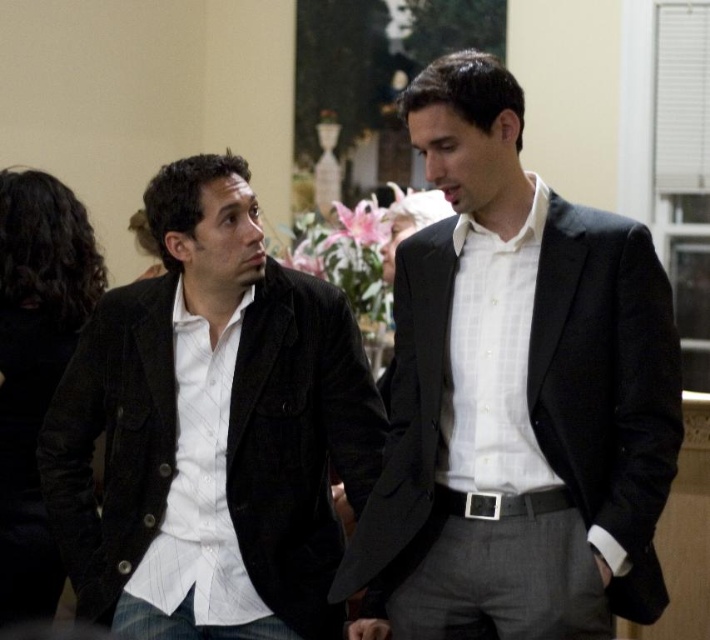
You are standing in the room and want to approach the person wearing the matte black jacket at left. Which direction should you move relative to the matte black suit at center?

To reach the matte black jacket at left, you should move to the left of the matte black suit at center since the matte black jacket at left is positioned to the left of the matte black suit at center.

Looking at this image, you are an interior designer assessing the spatial arrangement of the room. Given that the matte black suit at center and the matte black jacket at left are placed on a shelf, which one would you recommend moving to make more vertical space available?

The matte black jacket at left is shorter than the matte black suit at center, so moving the matte black jacket at left would free up more vertical space since it takes up less height.